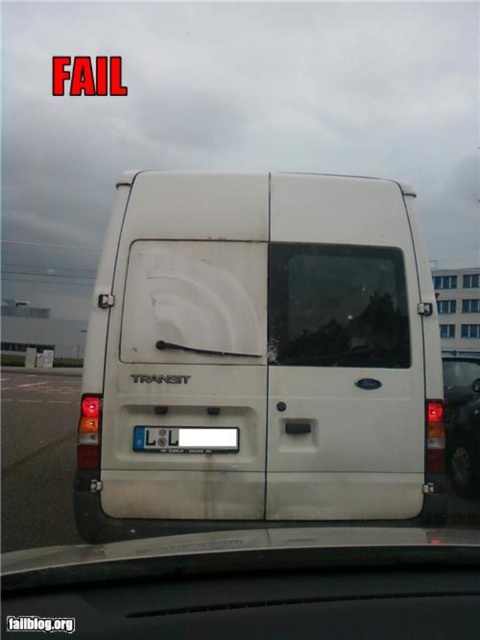
You are a delivery driver who needs to check the rearview mirror to reverse. You see the white matte van at center and the transparent glass windshield at center. Which object is larger in your view?

The white matte van at center is bigger than the transparent glass windshield at center, so the white matte van at center appears larger in your view.

You are a delivery driver who needs to enter a low clearance tunnel. Your vehicle is the white matte van at center. The tunnel has a height restriction sign indicating that the maximum allowed height is the same as the transparent glass windshield at center. Can your van pass through the tunnel without hitting the roof?

The white matte van at center is much taller than the transparent glass windshield at center. Since the tunnel allows vehicles up to the height of the transparent glass windshield at center, the van cannot pass through without hitting the roof.

You are a delivery driver who needs to check the license plate of the matte white van at center. Can you see the white plastic license plate at center clearly from the driver seat? Explain why or why not.

The matte white van at center is taller than the white plastic license plate at center, so the license plate is positioned lower and might be obscured by the van itself or other structures, making it difficult to see clearly from the driver seat.